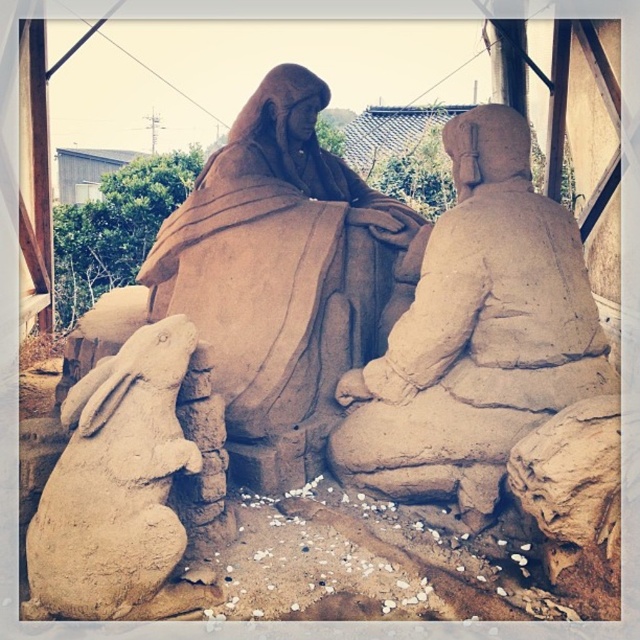
Between matte clay figure at center and smooth beige rabbit at lower left, which one is positioned higher?

Positioned higher is matte clay figure at center.

Who is positioned more to the right, matte clay figure at center or smooth beige rabbit at lower left?

matte clay figure at center

Does point (506, 452) lie behind point (124, 548)?

That is True.

The width and height of the screenshot is (640, 640). I want to click on matte clay figure at center, so click(476, 333).